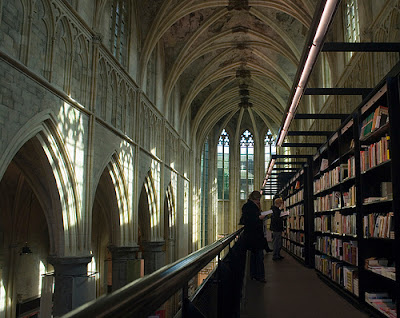
Image resolution: width=400 pixels, height=318 pixels. Identify the location of bookshelves. (328, 179), (293, 198), (376, 165).